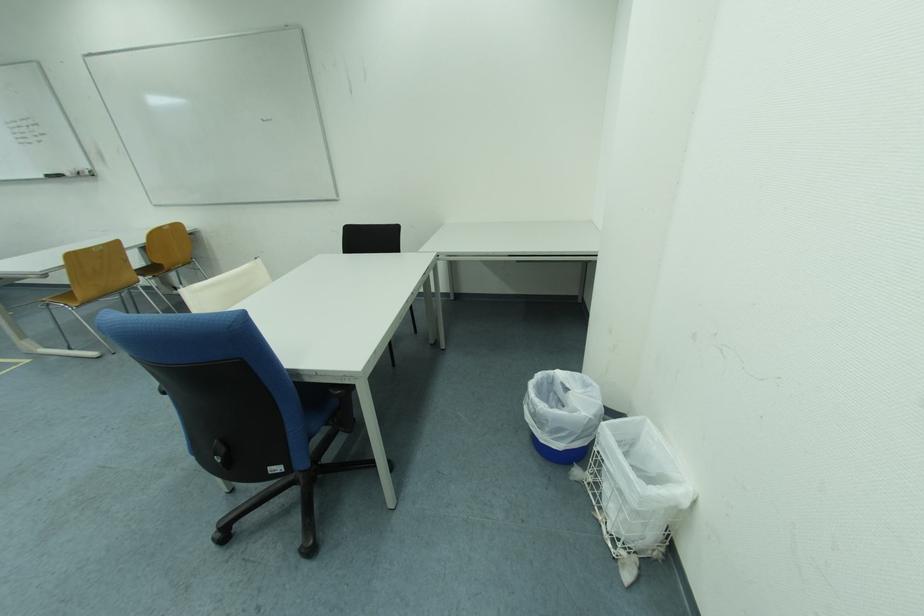
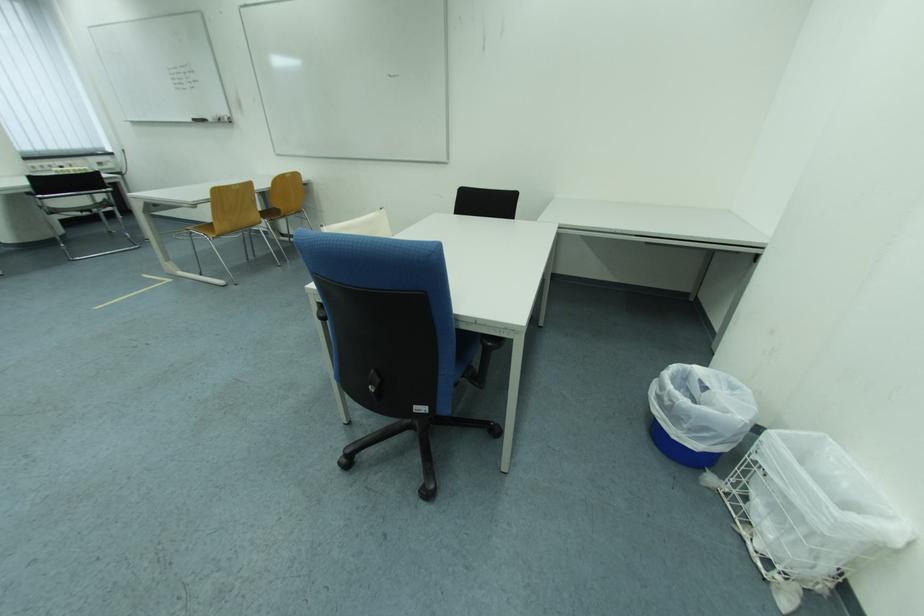
Question: The first image is from the beginning of the video and the second image is from the end. How did the camera likely rotate when shooting the video?

Choices:
 (A) Left
 (B) Right
 (C) Up
 (D) Down

Answer: (A)